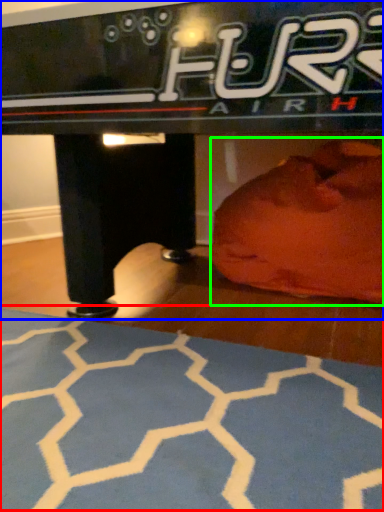
Question: Which object is positioned closest to yoga mat (highlighted by a red box)? Select from table (highlighted by a blue box) and bean bag chair (highlighted by a green box).

Choices:
 (A) table
 (B) bean bag chair

Answer: (A)